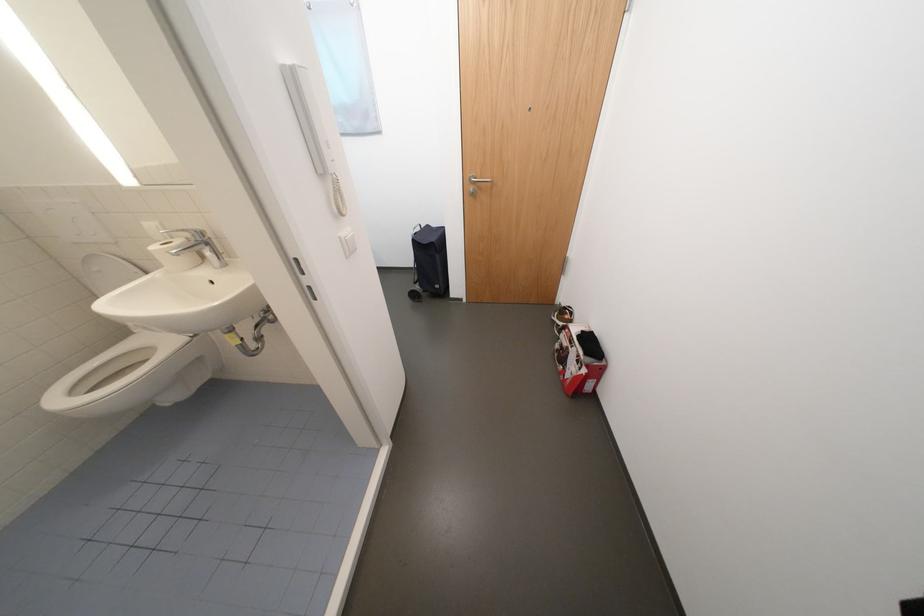
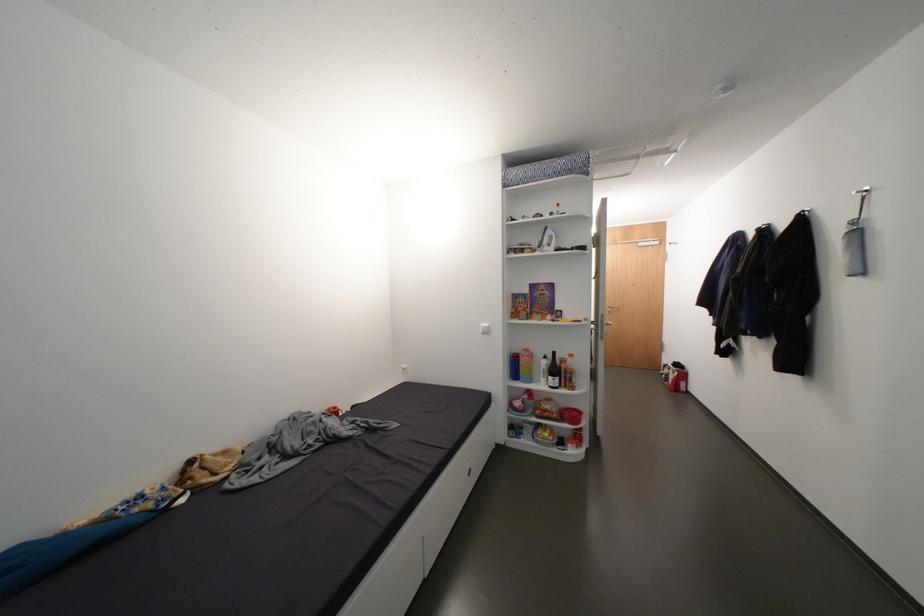
Find the pixel in the second image that matches [480,191] in the first image.

(616, 310)